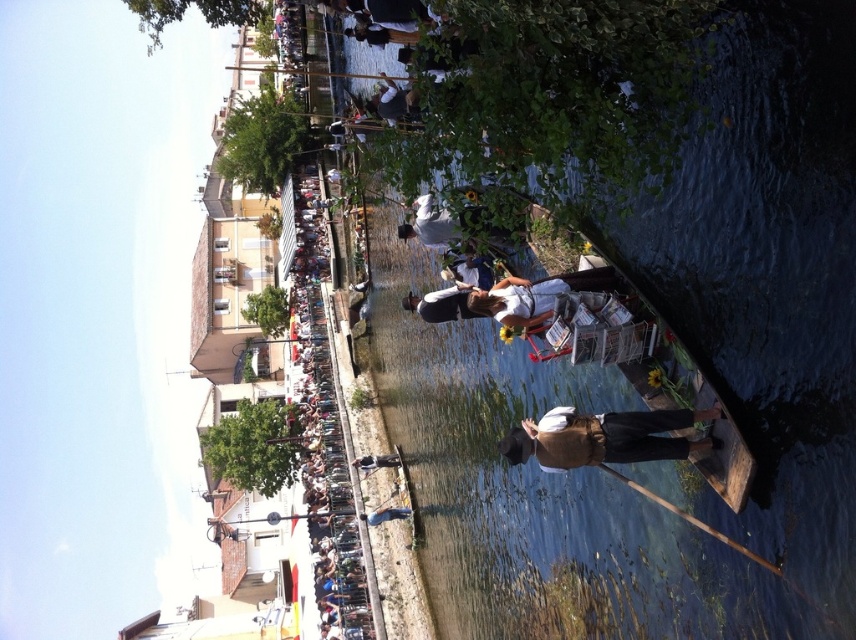
Does clear blue water at center appear over brown leather hat at center?

Actually, clear blue water at center is below brown leather hat at center.

Between point (443, 435) and point (566, 458), which one is positioned behind?

Positioned behind is point (443, 435).

Does point (424, 481) come closer to viewer compared to point (617, 416)?

That is False.

In order to click on clear blue water at center in this screenshot , I will do `click(702, 371)`.